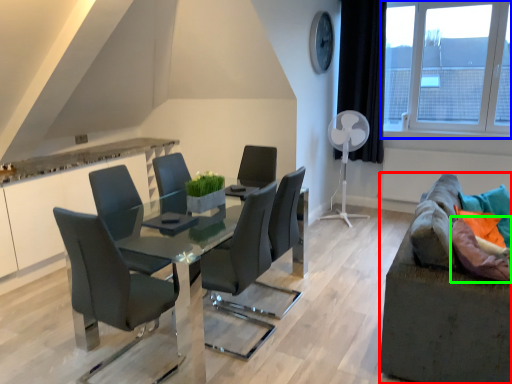
Question: Based on their relative distances, which object is farther from studio couch (highlighted by a red box)? Choose from window (highlighted by a blue box) and pillow (highlighted by a green box).

Choices:
 (A) window
 (B) pillow

Answer: (A)